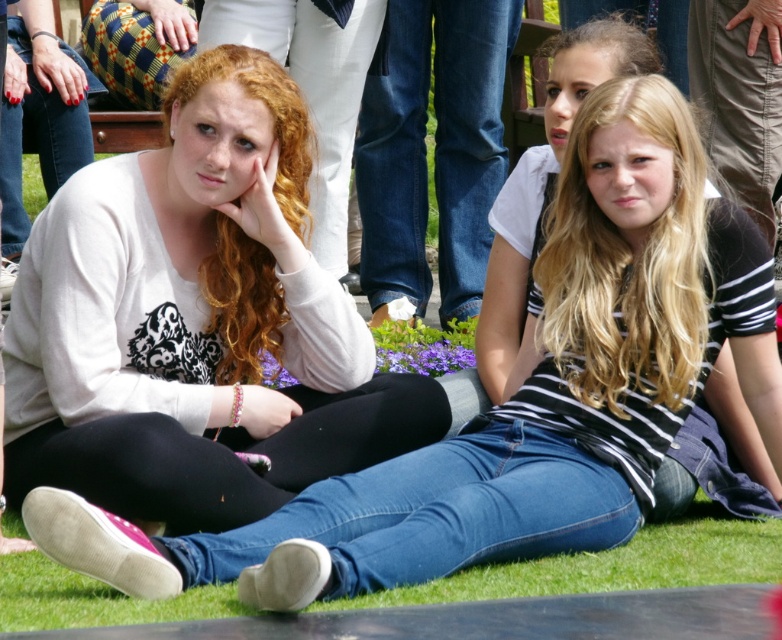
Question: Where is striped cotton shirt at center located in relation to green grass at lower center in the image?

Choices:
 (A) above
 (B) below

Answer: (A)

Question: Does white matte shirt at center have a lesser width compared to green grass at lower center?

Choices:
 (A) no
 (B) yes

Answer: (A)

Question: Which object is the closest to the green grass at lower center?

Choices:
 (A) striped cotton shirt at center
 (B) white matte shirt at center

Answer: (B)

Question: Does white matte shirt at center have a lesser width compared to striped cotton shirt at center?

Choices:
 (A) yes
 (B) no

Answer: (B)

Question: Estimate the real-world distances between objects in this image. Which object is farther from the striped cotton shirt at center?

Choices:
 (A) white matte shirt at center
 (B) green grass at lower center

Answer: (B)

Question: Among these points, which one is nearest to the camera?

Choices:
 (A) (719, 518)
 (B) (549, 100)
 (C) (310, 445)

Answer: (C)